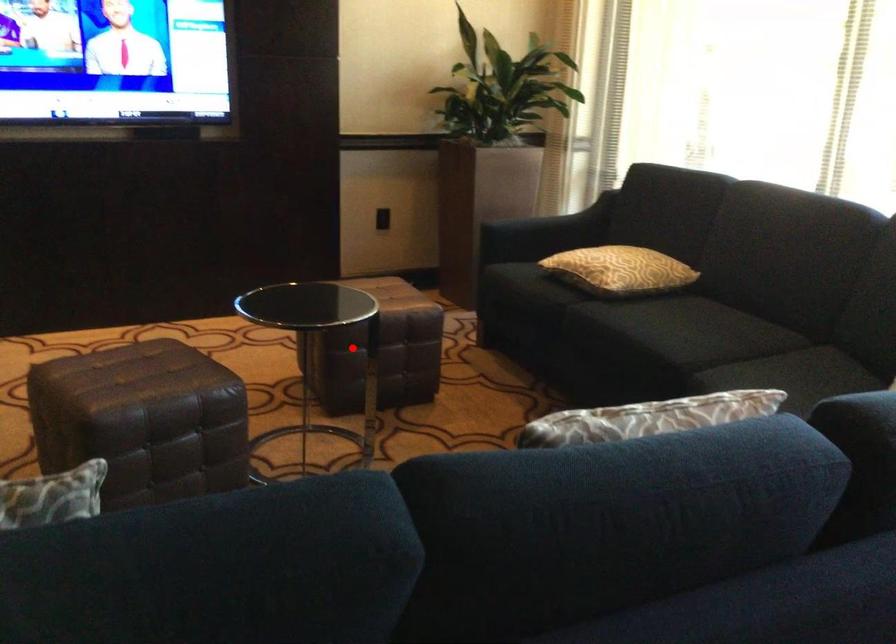
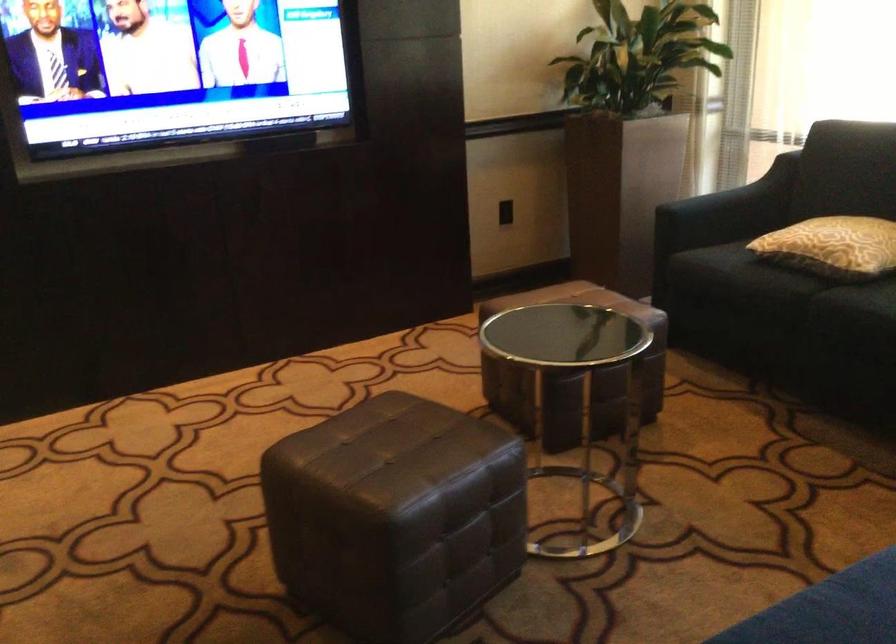
Question: A red point is marked in image1. In image2, is the corresponding 3D point closer to the camera or farther? Reply with the corresponding letter.

Choices:
 (A) The corresponding 3D point is closer.
 (B) The corresponding 3D point is farther.

Answer: (A)